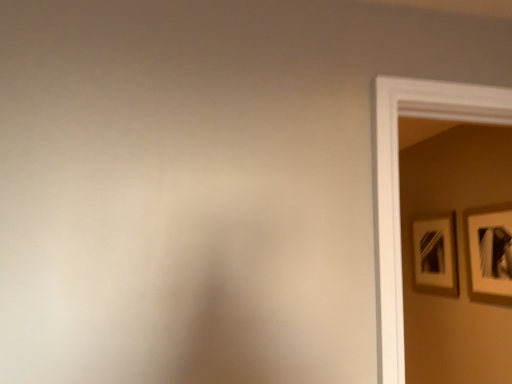
Question: From the image's perspective, would you say white matte picture frame at upper right, placed as the 1th picture frame when sorted from left to right, is shown under matte white picture frame at right, which ranks as the second picture frame in left-to-right order?

Choices:
 (A) yes
 (B) no

Answer: (A)

Question: Can you confirm if white matte picture frame at upper right, placed as the 1th picture frame when sorted from left to right, is smaller than matte white picture frame at right, which appears as the second picture frame when viewed from the back?

Choices:
 (A) yes
 (B) no

Answer: (B)

Question: Is matte white picture frame at right, which appears as the second picture frame when viewed from the back, located within white matte picture frame at upper right, which appears as the 2th picture frame when viewed from the front?

Choices:
 (A) no
 (B) yes

Answer: (A)

Question: Does white matte picture frame at upper right, acting as the first picture frame starting from the back, have a lesser height compared to matte white picture frame at right, the 1th picture frame positioned from the front?

Choices:
 (A) no
 (B) yes

Answer: (B)

Question: Considering the relative sizes of white matte picture frame at upper right, placed as the 1th picture frame when sorted from left to right, and matte white picture frame at right, the 1th picture frame positioned from the front, in the image provided, is white matte picture frame at upper right, placed as the 1th picture frame when sorted from left to right, thinner than matte white picture frame at right, the 1th picture frame positioned from the front,?

Choices:
 (A) no
 (B) yes

Answer: (B)

Question: Is white matte picture frame at upper right, the second picture frame when ordered from right to left, completely or partially outside of matte white picture frame at right, which appears as the second picture frame when viewed from the back?

Choices:
 (A) yes
 (B) no

Answer: (A)

Question: Are matte white picture frame at right, which appears as the second picture frame when viewed from the back, and white matte picture frame at upper right, the second picture frame when ordered from right to left, beside each other?

Choices:
 (A) yes
 (B) no

Answer: (B)

Question: Can you confirm if matte white picture frame at right, the 1th picture frame positioned from the front, is bigger than white matte picture frame at upper right, the second picture frame when ordered from right to left?

Choices:
 (A) yes
 (B) no

Answer: (B)

Question: From a real-world perspective, is matte white picture frame at right, the 1th picture frame positioned from the front, positioned over white matte picture frame at upper right, the second picture frame when ordered from right to left, based on gravity?

Choices:
 (A) yes
 (B) no

Answer: (A)

Question: Is matte white picture frame at right, which appears as the second picture frame when viewed from the back, smaller than white matte picture frame at upper right, the second picture frame when ordered from right to left?

Choices:
 (A) yes
 (B) no

Answer: (A)

Question: Is matte white picture frame at right, arranged as the 1th picture frame when viewed from the right, to the right of white matte picture frame at upper right, placed as the 1th picture frame when sorted from left to right, from the viewer's perspective?

Choices:
 (A) yes
 (B) no

Answer: (A)

Question: From the image's perspective, is matte white picture frame at right, which appears as the second picture frame when viewed from the back, on top of white matte picture frame at upper right, the second picture frame when ordered from right to left?

Choices:
 (A) yes
 (B) no

Answer: (A)

Question: Considering the positions of point (450, 283) and point (497, 220), is point (450, 283) closer or farther from the camera than point (497, 220)?

Choices:
 (A) farther
 (B) closer

Answer: (A)